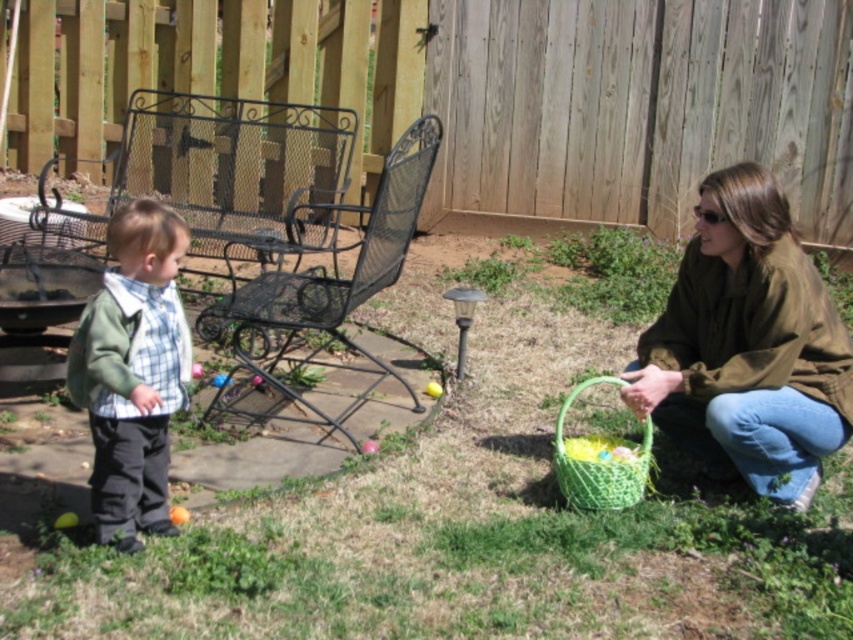
Is point (805, 408) behind point (633, 458)?

That is False.

Does matte brown jacket at lower right appear on the left side of green woven basket at lower right?

Incorrect, matte brown jacket at lower right is not on the left side of green woven basket at lower right.

The width and height of the screenshot is (853, 640). What do you see at coordinates (747, 346) in the screenshot?
I see `matte brown jacket at lower right` at bounding box center [747, 346].

Where is `matte brown jacket at lower right`? matte brown jacket at lower right is located at coordinates click(747, 346).

Which of these two, matte brown jacket at lower right or green cotton shirt at left, stands shorter?

Standing shorter between the two is green cotton shirt at left.

Can you confirm if matte brown jacket at lower right is positioned below green cotton shirt at left?

Incorrect, matte brown jacket at lower right is not positioned below green cotton shirt at left.

Does point (756, 168) come behind point (142, 230)?

Yes, it is behind point (142, 230).

Identify the location of matte brown jacket at lower right. (747, 346).

Describe the element at coordinates (132, 371) in the screenshot. I see `green cotton shirt at left` at that location.

What do you see at coordinates (132, 371) in the screenshot? The height and width of the screenshot is (640, 853). I see `green cotton shirt at left` at bounding box center [132, 371].

Find the location of a particular element. green cotton shirt at left is located at coordinates pyautogui.click(x=132, y=371).